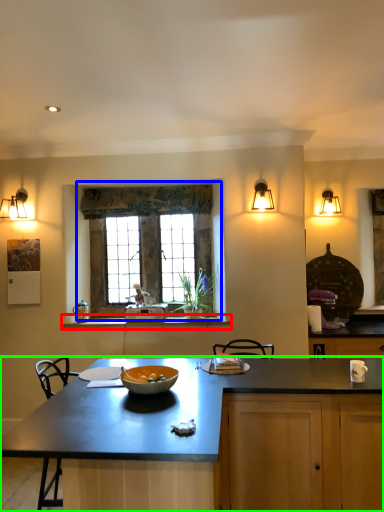
Question: Which object is the farthest from window sill (highlighted by a red box)? Choose among these: window (highlighted by a blue box) or countertop (highlighted by a green box).

Choices:
 (A) window
 (B) countertop

Answer: (B)